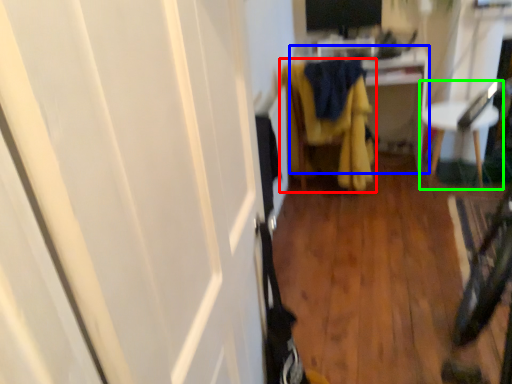
Question: Estimate the real-world distances between objects in this image. Which object is farther from furniture (highlighted by a red box), cabinetry (highlighted by a blue box) or furniture (highlighted by a green box)?

Choices:
 (A) cabinetry
 (B) furniture

Answer: (B)